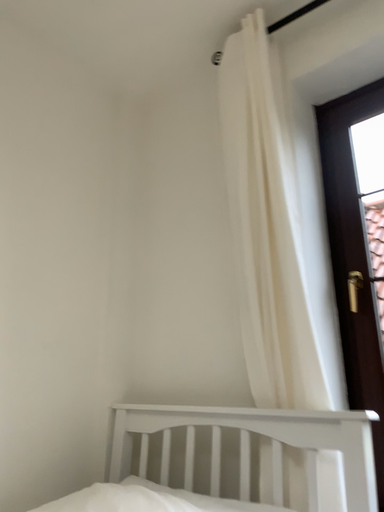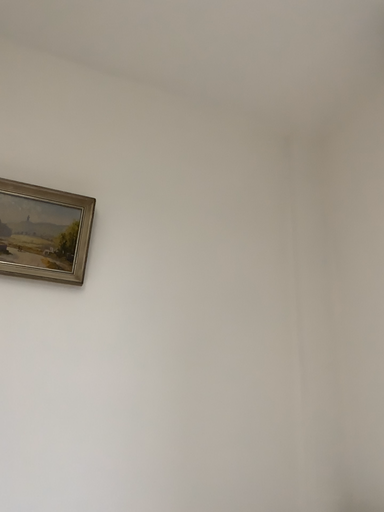
Question: How did the camera likely rotate when shooting the video?

Choices:
 (A) rotated downward
 (B) rotated upward

Answer: (B)